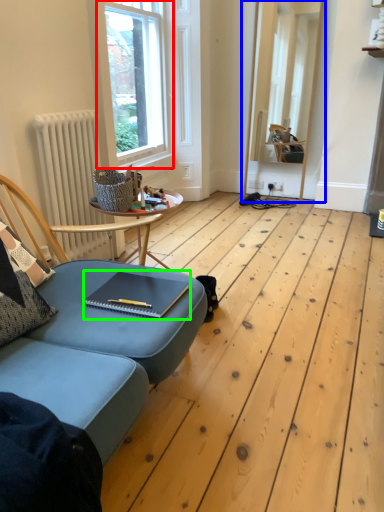
Question: Which object is the closest to the window (highlighted by a red box)? Choose among these: window frame (highlighted by a blue box) or notebook (highlighted by a green box).

Choices:
 (A) window frame
 (B) notebook

Answer: (A)